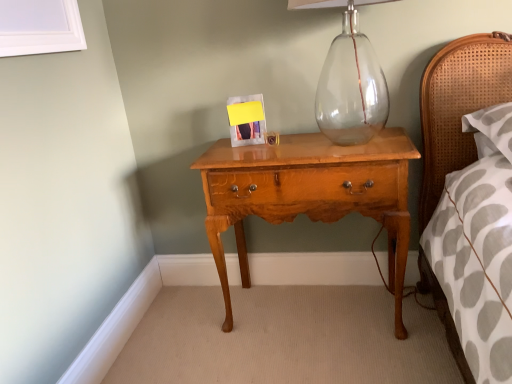
Where is `vacant area that is in front of light brown wood nightstand at center`? vacant area that is in front of light brown wood nightstand at center is located at coordinates (334, 358).